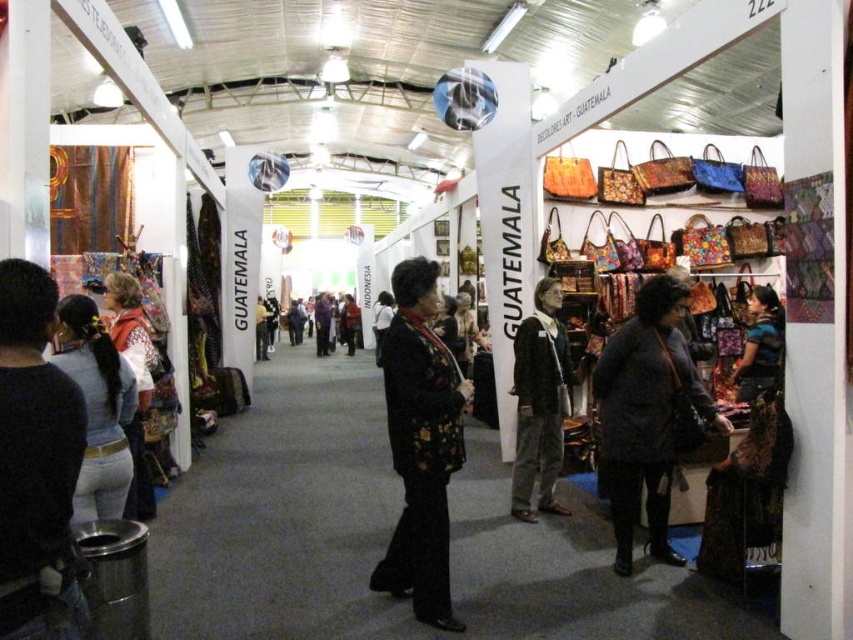
You are a customer at the Guatemala stall and want to purchase a handbag. You see the dark gray fabric coat at center and the white knitwear at left. Which item is positioned lower in the display?

The dark gray fabric coat at center is located below the white knitwear at left, so it is positioned lower in the display.

You are at the Guatemala stall and want to reach the handbags displayed at point (100, 408). There is an obstacle at point (380, 586). Can you walk directly to the handbags without going around the obstacle?

Point (380, 586) is behind point (100, 408), so the obstacle is behind the handbags. Therefore, you can walk directly to the handbags at (100, 408) without needing to go around the obstacle at (380, 586).

You are a customer at the Guatemala stall and want to buy both the black matte jacket at center and the light blue denim jeans at lower left. If you need to reach for the items from your current position, which one would you need to move to your right to get?

The black matte jacket at center is positioned on the right side of light blue denim jeans at lower left. Therefore, to reach the black matte jacket at center, you would need to move to your right from the light blue denim jeans at lower left.